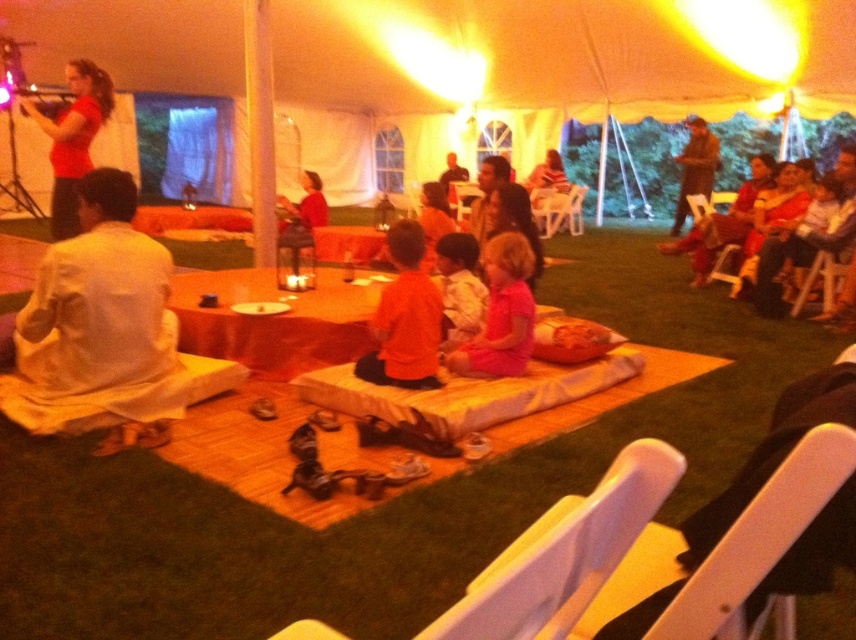
Is pink matte dress at center closer to camera compared to brown leather jacket at upper right?

Yes.

Is point (480, 371) positioned after point (698, 156)?

No, it is not.

Find the location of a particular element. The width and height of the screenshot is (856, 640). pink matte dress at center is located at coordinates (501, 312).

Can you confirm if pink matte dress at center is thinner than matte red shirt at upper left?

Yes, pink matte dress at center is thinner than matte red shirt at upper left.

Which is behind, point (513, 336) or point (90, 84)?

Positioned behind is point (90, 84).

Is point (522, 284) in front of point (55, 129)?

Yes, point (522, 284) is in front of point (55, 129).

This screenshot has height=640, width=856. I want to click on pink matte dress at center, so click(501, 312).

Looking at this image, can you confirm if matte pink dress at right is positioned above matte red shirt at center?

Incorrect, matte pink dress at right is not positioned above matte red shirt at center.

Can you confirm if matte pink dress at right is positioned to the right of matte red shirt at center?

Correct, you'll find matte pink dress at right to the right of matte red shirt at center.

Which is in front, point (797, 262) or point (321, 221)?

Positioned in front is point (797, 262).

This screenshot has height=640, width=856. I want to click on matte pink dress at right, so click(x=807, y=236).